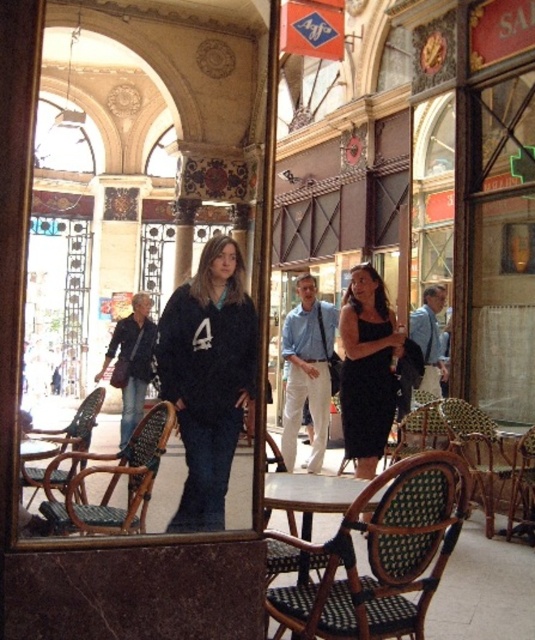
What do you see at coordinates (430, 339) in the screenshot?
I see `blue denim jeans at center` at bounding box center [430, 339].

Is blue denim jeans at center above green woven chair at lower right?

Yes.

Does point (431, 324) lie behind point (530, 508)?

Yes, point (431, 324) is behind point (530, 508).

I want to click on blue denim jeans at center, so click(x=430, y=339).

Between woven rattan chair at lower center and woven rattan chair at lower right, which one has more height?

woven rattan chair at lower center

Which is more to the right, woven rattan chair at lower center or woven rattan chair at lower right?

woven rattan chair at lower right is more to the right.

Which is in front, point (316, 593) or point (482, 502)?

Point (316, 593)

Identify the location of woven rattan chair at lower center. (380, 556).

Is denim jacket at left further to the viewer compared to woven wood chair at lower left?

Yes, it is behind woven wood chair at lower left.

Can you confirm if denim jacket at left is thinner than woven wood chair at lower left?

Indeed, denim jacket at left has a lesser width compared to woven wood chair at lower left.

Is point (118, 333) in front of point (94, 419)?

No, (118, 333) is behind (94, 419).

At what (x,y) coordinates should I click in order to perform the action: click on denim jacket at left. Please return your answer as a coordinate pair (x, y). This screenshot has width=535, height=640. Looking at the image, I should click on coord(132,362).